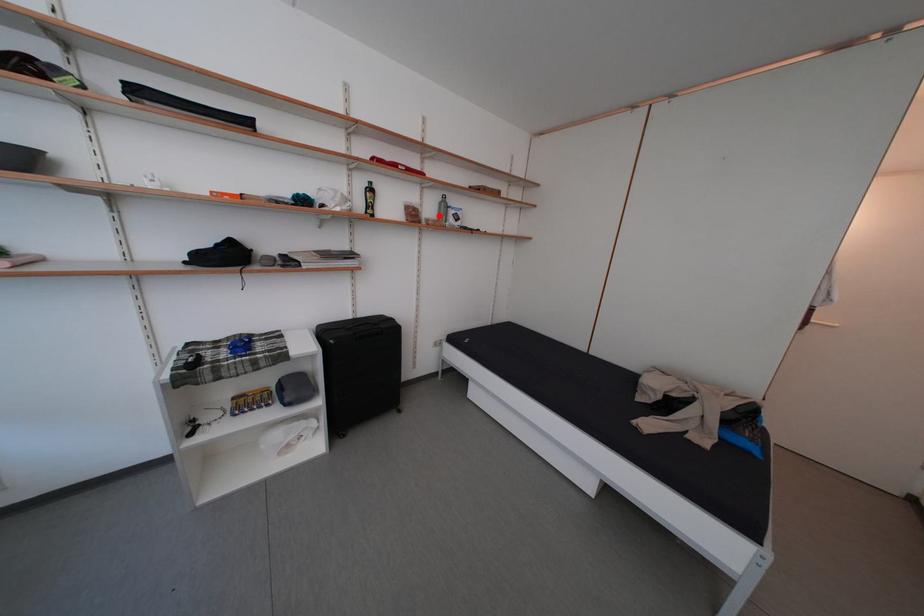
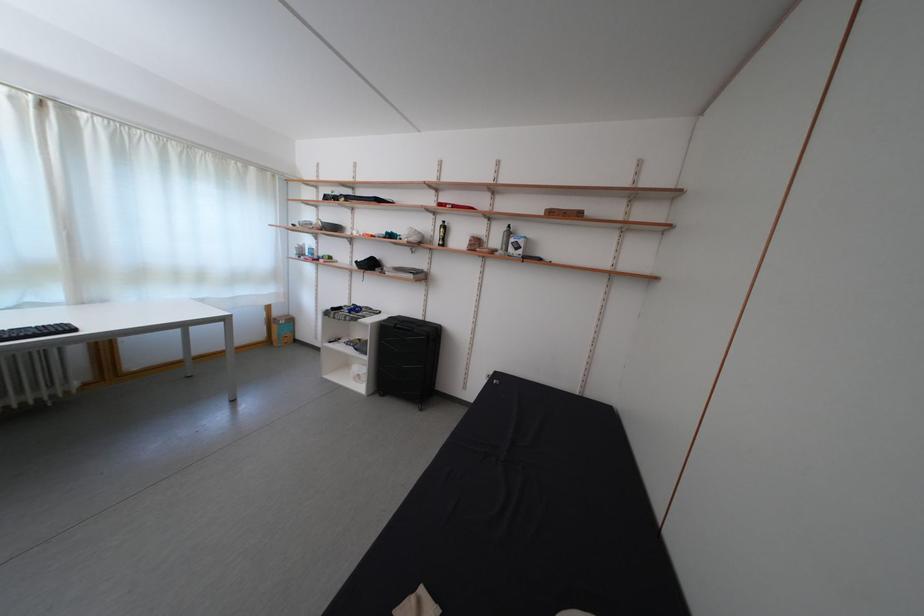
The point at the highlighted location is marked in the first image. Where is the corresponding point in the second image?

(505, 246)